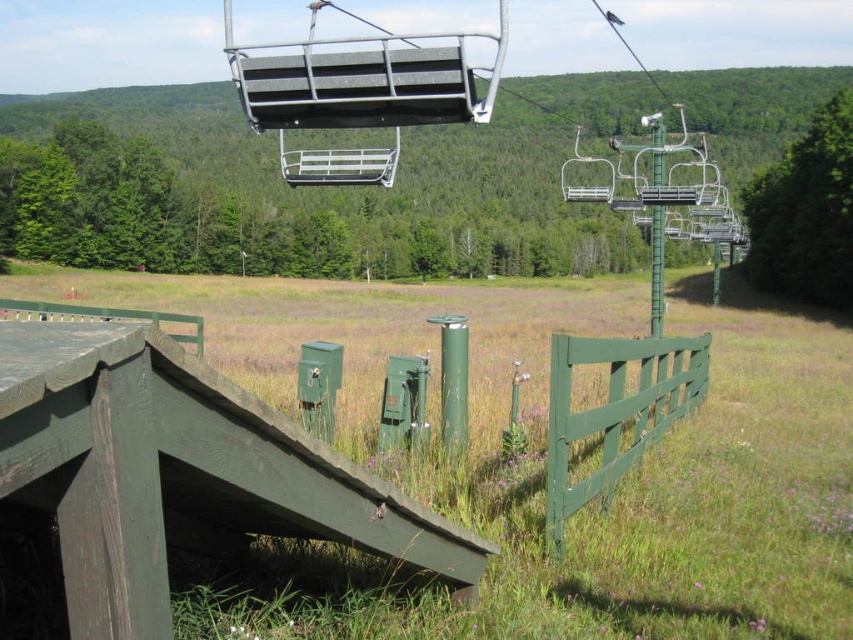
You are standing at the base of the ski resort and see the green wood ramp at lower center and the green wooden fence at lower right. Which object is nearer to you?

The green wood ramp at lower center is closer to the viewer than the green wooden fence at lower right.

You are a maintenance worker needing to transport a large equipment box that measures 2 meters in length. You have to move it from the platform to the storage area near the fence. Given the green wood ramp at lower center and the green wooden fence at lower right, which object might pose a challenge due to its dimensions?

The green wood ramp at lower center has a smaller size compared to the green wooden fence at lower right, so the green wood ramp at lower center might pose a challenge due to its smaller dimensions when moving the large equipment box.